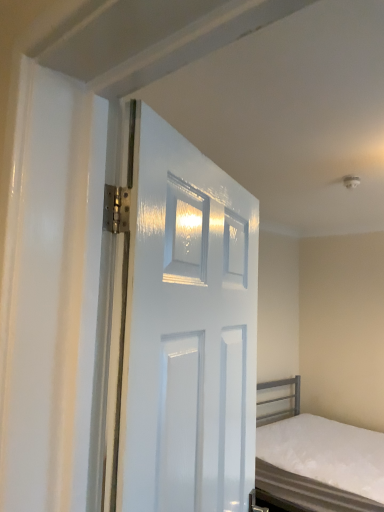
Question: Can you confirm if white matte bed at lower right is positioned to the right of white glossy door at center?

Choices:
 (A) no
 (B) yes

Answer: (B)

Question: Is white matte bed at lower right positioned in front of white glossy door at center?

Choices:
 (A) no
 (B) yes

Answer: (A)

Question: Is white matte bed at lower right positioned beyond the bounds of white glossy door at center?

Choices:
 (A) yes
 (B) no

Answer: (A)

Question: From the image's perspective, does white matte bed at lower right appear lower than white glossy door at center?

Choices:
 (A) no
 (B) yes

Answer: (B)

Question: From a real-world perspective, is white matte bed at lower right physically above white glossy door at center?

Choices:
 (A) no
 (B) yes

Answer: (A)

Question: Does white matte bed at lower right have a greater height compared to white glossy door at center?

Choices:
 (A) no
 (B) yes

Answer: (A)

Question: Can you confirm if white glossy door at center is shorter than white matte bed at lower right?

Choices:
 (A) no
 (B) yes

Answer: (A)

Question: Can you confirm if white glossy door at center is taller than white matte bed at lower right?

Choices:
 (A) no
 (B) yes

Answer: (B)

Question: From the image's perspective, does white glossy door at center appear lower than white matte bed at lower right?

Choices:
 (A) no
 (B) yes

Answer: (A)

Question: Is white glossy door at center thinner than white matte bed at lower right?

Choices:
 (A) yes
 (B) no

Answer: (A)

Question: Is white matte bed at lower right a part of white glossy door at center?

Choices:
 (A) no
 (B) yes

Answer: (A)

Question: Is white glossy door at center not near white matte bed at lower right?

Choices:
 (A) yes
 (B) no

Answer: (A)

Question: Based on their sizes in the image, would you say white glossy door at center is bigger or smaller than white matte bed at lower right?

Choices:
 (A) small
 (B) big

Answer: (A)